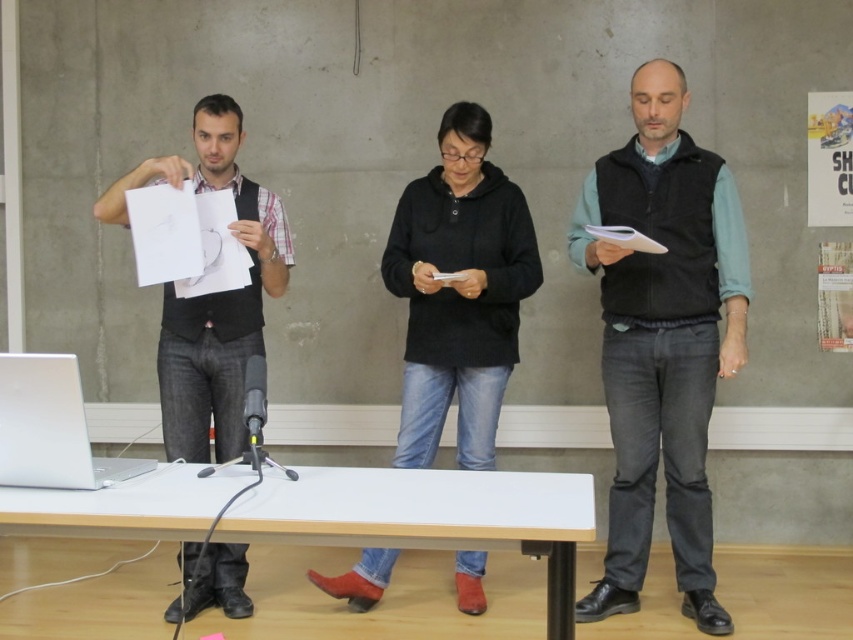
Based on the scene description, if you were standing in the room facing the three individuals, which object would be closer to your right side, the black matte jacket at center or the silver metallic laptop at lower left?

The black matte jacket at center is to the right of the silver metallic laptop at lower left, so the black matte jacket at center would be closer to your right side when facing the individuals.

You are an observer in the room. You notice two items at the center of the image, the dark gray vest at center and the black matte jacket at center. Which one is closer to you?

The dark gray vest at center is closer to you because it is in front of the black matte jacket at center.

Consider the image. You are organizing a small event and need to determine if a decorative ribbon that is 1 meter long can be draped across the dark gray vest at center and the white wood table at lower center. Based on their widths, will the ribbon be long enough?

The dark gray vest at center has a lesser width compared to the white wood table at lower center. Since the ribbon is 1 meter long, it should be sufficient to cover both items as the combined width would be less than 1 meter.